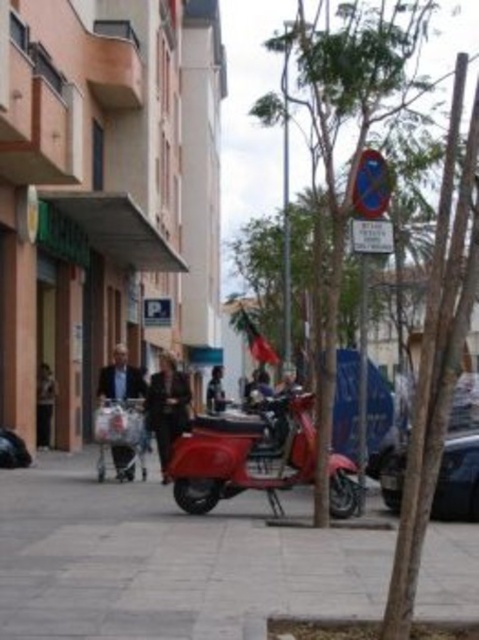
Question: Is green leafy tree at center to the left of metallic red scooter at center from the viewer's perspective?

Choices:
 (A) no
 (B) yes

Answer: (A)

Question: Among these points, which one is nearest to the camera?

Choices:
 (A) (389, 93)
 (B) (285, 560)

Answer: (B)

Question: Is green leafy tree at center positioned before metallic red scooter at center?

Choices:
 (A) yes
 (B) no

Answer: (A)

Question: Which object is farther from the camera taking this photo?

Choices:
 (A) gray concrete pavement at center
 (B) shiny black car at right
 (C) green leafy tree at center

Answer: (B)

Question: Among these objects, which one is farthest from the camera?

Choices:
 (A) metallic red scooter at center
 (B) shiny black car at right

Answer: (B)

Question: Does gray concrete pavement at center have a larger size compared to green leafy tree at center?

Choices:
 (A) yes
 (B) no

Answer: (B)